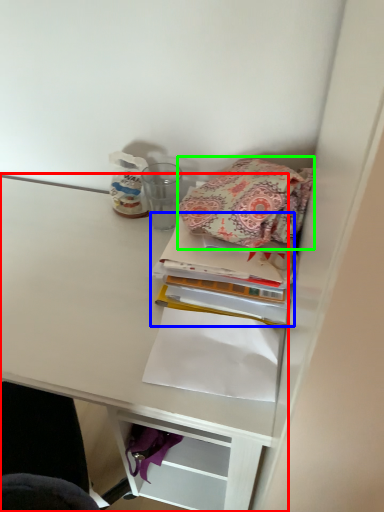
Question: Which object is the closest to the shelf (highlighted by a red box)? Choose among these: book (highlighted by a blue box) or cloth (highlighted by a green box).

Choices:
 (A) book
 (B) cloth

Answer: (A)